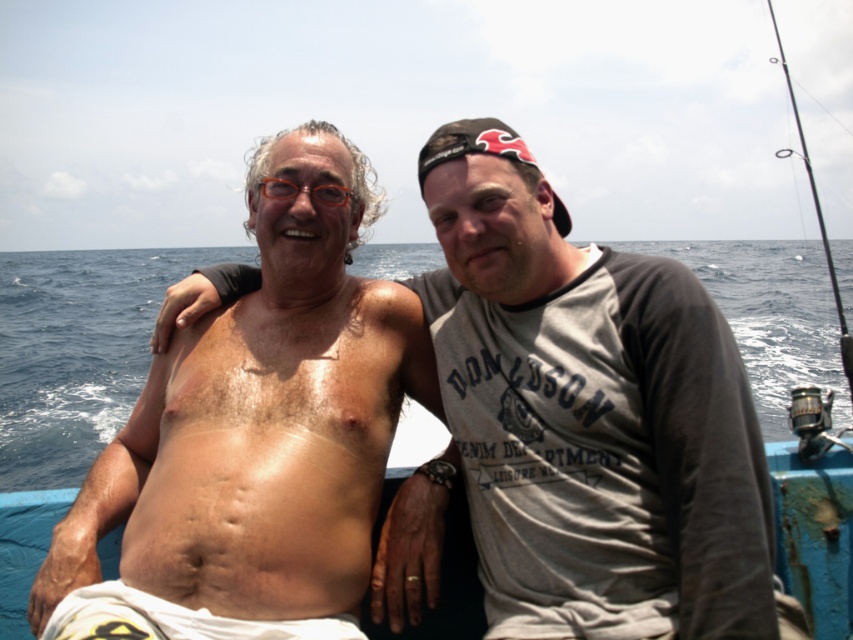
Question: Does dry skin at center appear on the right side of black metallic fishing pole at right?

Choices:
 (A) yes
 (B) no

Answer: (B)

Question: Estimate the real-world distances between objects in this image. Which object is farther from the black metallic fishing pole at right?

Choices:
 (A) blue water at center
 (B) shiny skin torso at center

Answer: (A)

Question: Is skinny white man at center to the right of blue water at center from the viewer's perspective?

Choices:
 (A) yes
 (B) no

Answer: (A)

Question: Which of the following is the farthest from the observer?

Choices:
 (A) (194, 568)
 (B) (260, 513)
 (C) (537, 202)
 (D) (405, 452)

Answer: (D)

Question: Observing the image, what is the correct spatial positioning of blue water at center in reference to black metallic fishing pole at right?

Choices:
 (A) left
 (B) right

Answer: (A)

Question: Which point is farther from the camera taking this photo?

Choices:
 (A) (369, 524)
 (B) (299, 515)

Answer: (A)